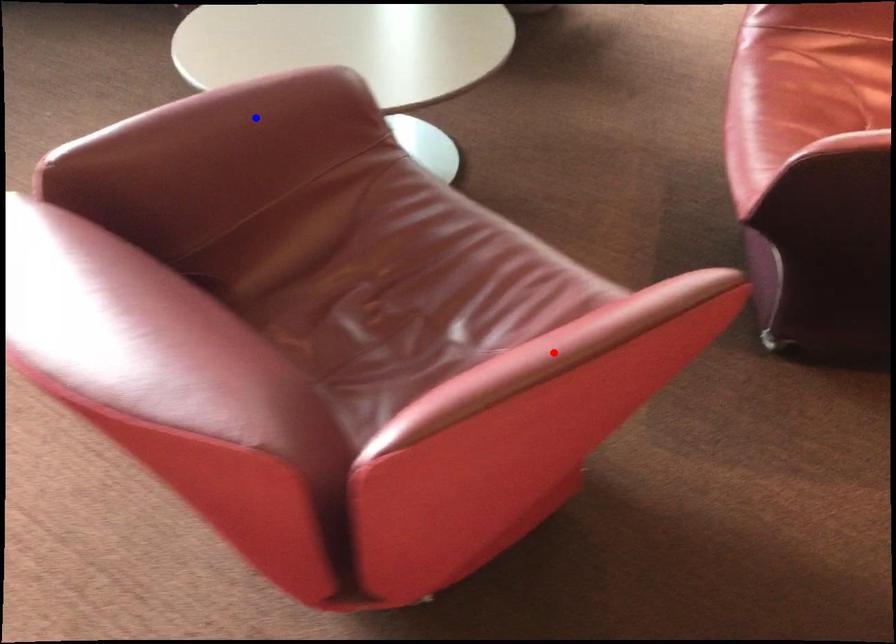
Question: In the image, two points are highlighted. Which point is nearer to the camera? Reply with the corresponding letter.

Choices:
 (A) blue point
 (B) red point

Answer: (B)